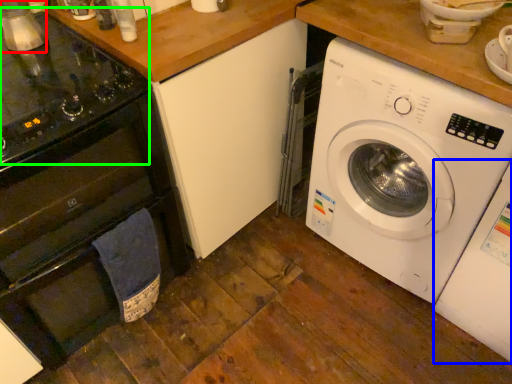
Question: Based on their relative distances, which object is farther from appliance (highlighted by a red box)? Choose from washing machine (highlighted by a blue box) and gas stove (highlighted by a green box).

Choices:
 (A) washing machine
 (B) gas stove

Answer: (A)